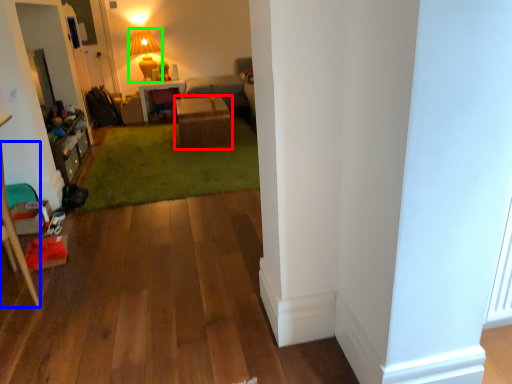
Question: Which is nearer to the table (highlighted by a red box)? furniture (highlighted by a blue box) or lamp (highlighted by a green box).

Choices:
 (A) furniture
 (B) lamp

Answer: (B)